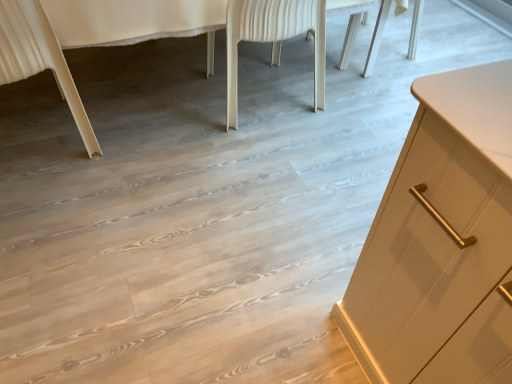
I want to click on free space in front of white glossy cabinet at right, so [188, 220].